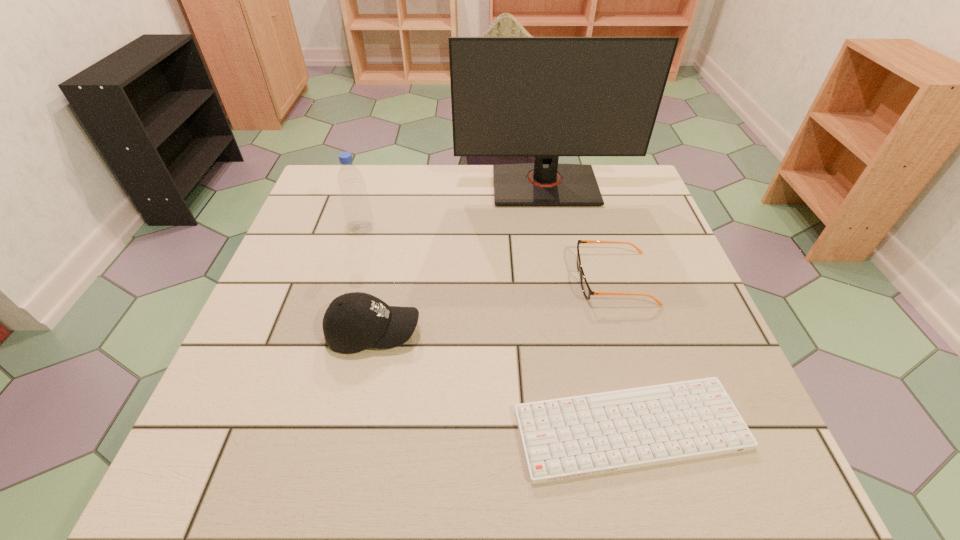
In the image, there is a desktop. At what (x,y) coordinates should I click in order to perform the action: click on vacant space at the far left corner. Please return your answer as a coordinate pair (x, y). Looking at the image, I should click on (322, 176).

Locate an element on the screen. The image size is (960, 540). vacant space at the near left corner of the desktop is located at coordinates (219, 444).

Identify the location of free point at the far right corner. (650, 211).

The height and width of the screenshot is (540, 960). What are the coordinates of `empty space between the baseball cap and the bottle` in the screenshot? It's located at (368, 281).

In order to click on vacant point located between the monitor and the second tallest object in this screenshot , I will do `click(453, 207)`.

Identify the location of blank region between the spectacles and the monitor. (580, 232).

The image size is (960, 540). What are the coordinates of `vacant space that is in between the nearest object and the second farthest object` in the screenshot? It's located at (496, 329).

The width and height of the screenshot is (960, 540). In order to click on free area in between the second farthest object and the third nearest object in this screenshot , I will do `click(488, 254)`.

You are a GUI agent. You are given a task and a screenshot of the screen. Output one action in this format:
    pyautogui.click(x=<x>, y=<y>)
    Task: Click on the free spot between the fourth shortest object and the shortest object
    The width and height of the screenshot is (960, 540).
    Given the screenshot: What is the action you would take?
    pyautogui.click(x=496, y=329)

At what (x,y) coordinates should I click in order to perform the action: click on unoccupied area between the fourth tallest object and the computer keyboard. Please return your answer as a coordinate pair (x, y). The height and width of the screenshot is (540, 960). Looking at the image, I should click on [622, 354].